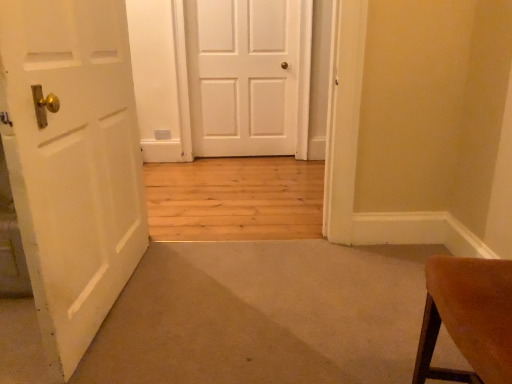
Question: From the image's perspective, is white matte door at center, which is the second door from top to bottom, located above or below white matte door at center, which ranks as the first door in back-to-front order?

Choices:
 (A) below
 (B) above

Answer: (A)

Question: Would you say white matte door at center, marked as the 1th door in a bottom-to-top arrangement, is to the left or to the right of white matte door at center, arranged as the second door when viewed from the front, in the picture?

Choices:
 (A) right
 (B) left

Answer: (B)

Question: Is white matte door at center, the first door from the front, situated inside white matte door at center, which is the 1th door from top to bottom, or outside?

Choices:
 (A) outside
 (B) inside

Answer: (A)

Question: Based on their positions, is white matte door at center, which is the 1th door from top to bottom, located to the left or right of white matte door at center, which is counted as the second door, starting from the back?

Choices:
 (A) left
 (B) right

Answer: (B)

Question: From a real-world perspective, is white matte door at center, which is the 1th door from top to bottom, above or below white matte door at center, which is the second door from top to bottom?

Choices:
 (A) above
 (B) below

Answer: (A)

Question: Looking at the image, does white matte door at center, which ranks as the first door in back-to-front order, seem bigger or smaller compared to white matte door at center, which is counted as the second door, starting from the back?

Choices:
 (A) big
 (B) small

Answer: (B)

Question: Relative to white matte door at center, which is the second door from top to bottom, is white matte door at center, which is the 1th door from top to bottom, in front or behind?

Choices:
 (A) front
 (B) behind

Answer: (B)